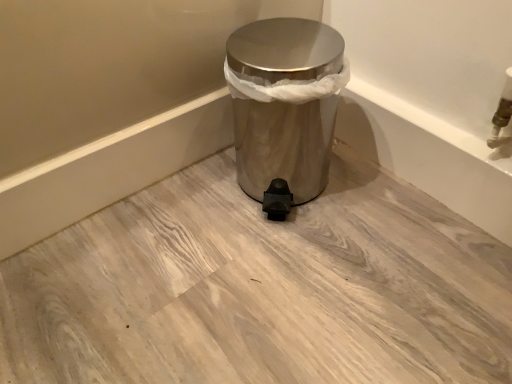
The width and height of the screenshot is (512, 384). In order to click on polished stainless steel trash can at center in this screenshot , I will do `click(284, 145)`.

The image size is (512, 384). What do you see at coordinates (284, 145) in the screenshot? I see `polished stainless steel trash can at center` at bounding box center [284, 145].

What are the coordinates of `polished stainless steel trash can at center` in the screenshot? It's located at (284, 145).